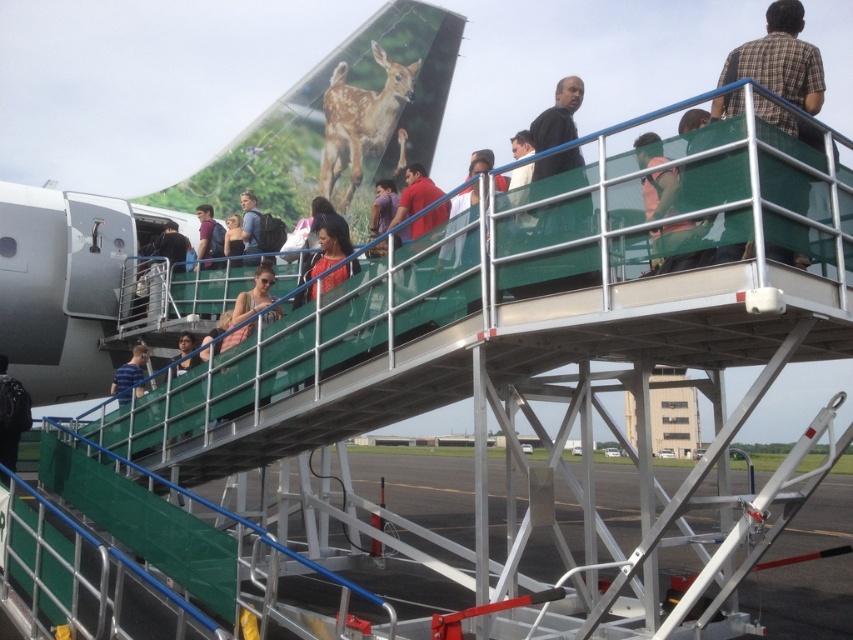
Does metallic gray tarmac at lower center have a smaller size compared to plaid shirt at upper right?

Actually, metallic gray tarmac at lower center might be larger than plaid shirt at upper right.

Does metallic gray tarmac at lower center have a lesser height compared to plaid shirt at upper right?

No.

Which is behind, point (772, 621) or point (770, 124)?

Positioned behind is point (772, 621).

You are a GUI agent. You are given a task and a screenshot of the screen. Output one action in this format:
    pyautogui.click(x=<x>, y=<y>)
    Task: Click on the metallic gray tarmac at lower center
    This screenshot has width=853, height=640.
    Given the screenshot: What is the action you would take?
    pyautogui.click(x=422, y=486)

Is point (334, 531) closer to camera compared to point (248, 259)?

That is False.

The height and width of the screenshot is (640, 853). Describe the element at coordinates (422, 486) in the screenshot. I see `metallic gray tarmac at lower center` at that location.

Identify the location of metallic gray tarmac at lower center. Image resolution: width=853 pixels, height=640 pixels. (422, 486).

Is plaid shirt at upper right shorter than matte red shirt at center?

No, plaid shirt at upper right is not shorter than matte red shirt at center.

Between plaid shirt at upper right and matte red shirt at center, which one is positioned higher?

plaid shirt at upper right is above.

Does point (793, 124) come farther from viewer compared to point (450, 200)?

That is False.

Locate an element on the screen. This screenshot has width=853, height=640. plaid shirt at upper right is located at coordinates (780, 60).